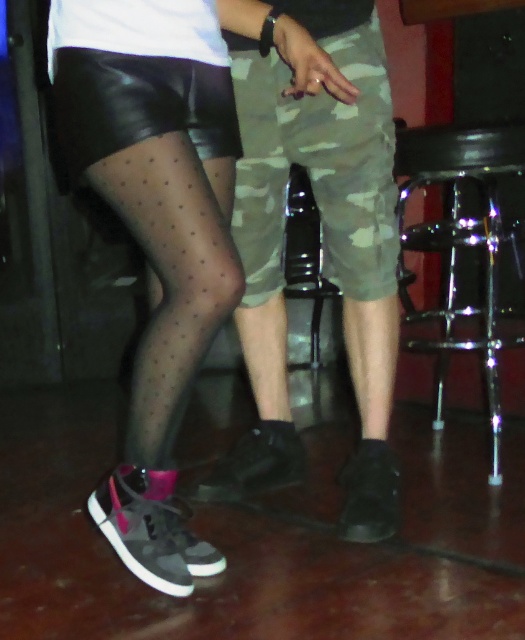
You are a delivery person trying to place a small package between the camouflage fabric shorts at center and the shiny chrome bar stool at right. Can you fit the package if it measures 18 inches in length?

The camouflage fabric shorts at center and the shiny chrome bar stool at right are 19.37 inches apart. Since the package is 18 inches long, it should fit between them with about 1.37 inches of space remaining.

What is located at the coordinates point (318, 156) in the image?

A: The point (318, 156) corresponds to camouflage fabric shorts at center.

You are a fashion designer trying to create a matching outfit for two models. You have two pairs of camouflage fabric shorts at center. What is the minimum distance you need to keep between the two models to ensure their camo fabric shorts at center are aligned properly?

The camo fabric shorts at center and camouflage fabric shorts at center are 2.69 inches apart. To align their camouflage fabric shorts at center properly, the models should be positioned 2.69 inches apart.